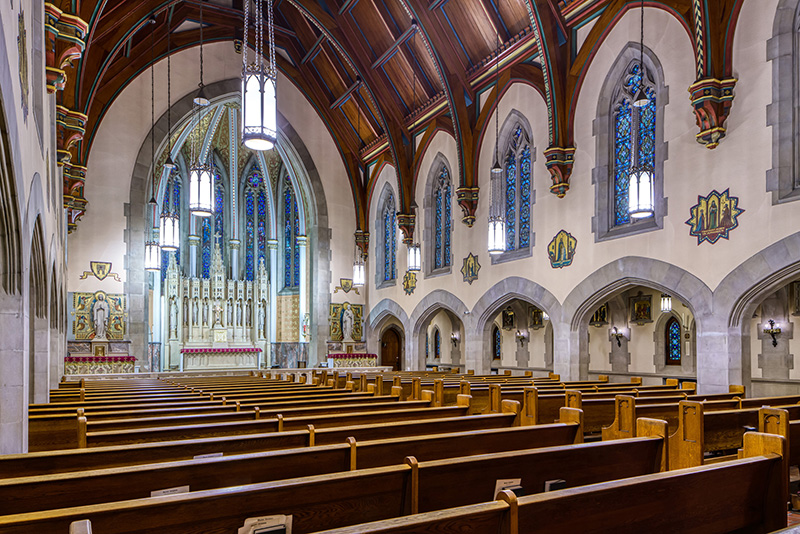
The width and height of the screenshot is (800, 534). Find the location of `floor`. floor is located at coordinates (797, 520).